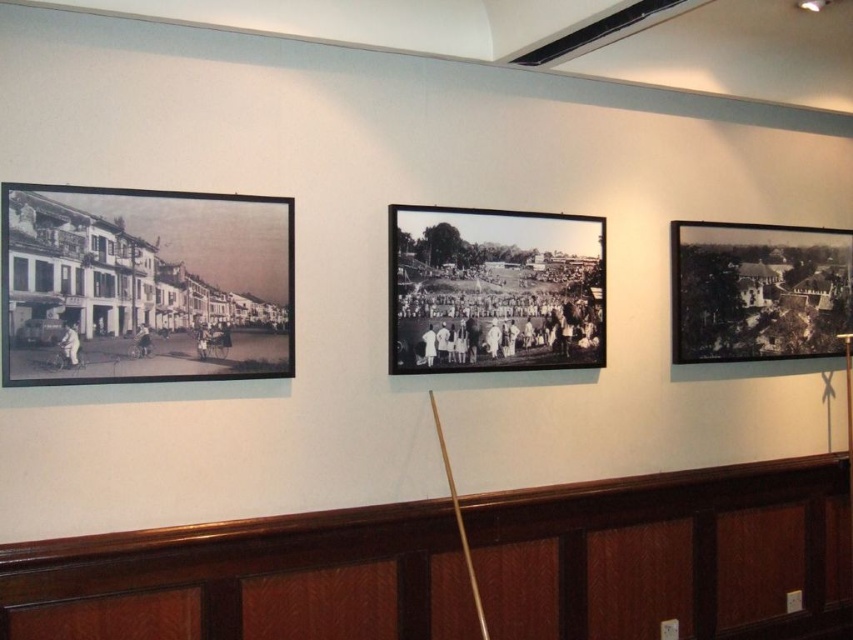
You are hanging two black papers on a wall. The black paper at center and the black paper at right. According to the scene description, which one is placed lower?

The black paper at center is placed lower because it is located below the black paper at right.

You are hanging a new poster on the wall between the black paper at left and the black paper at right. Which side of the wall between them has more vertical space available?

The black paper at left is shorter than the black paper at right, so the side between them closer to the black paper at left has more vertical space available.

You are an art curator arranging a gallery exhibit. You have two black papers displayed on a wall with three framed black and white photographs. The leftmost photograph shows a colonial street scene with bicycles, and the rightmost photograph has a different subject. You need to place the black paper at left and black paper at right in relation to the photographs. According to the description, where should each black paper be placed?

The black paper at left should be placed to the left of the black paper at right since the black paper at left is to the left of black paper at right according to the description.